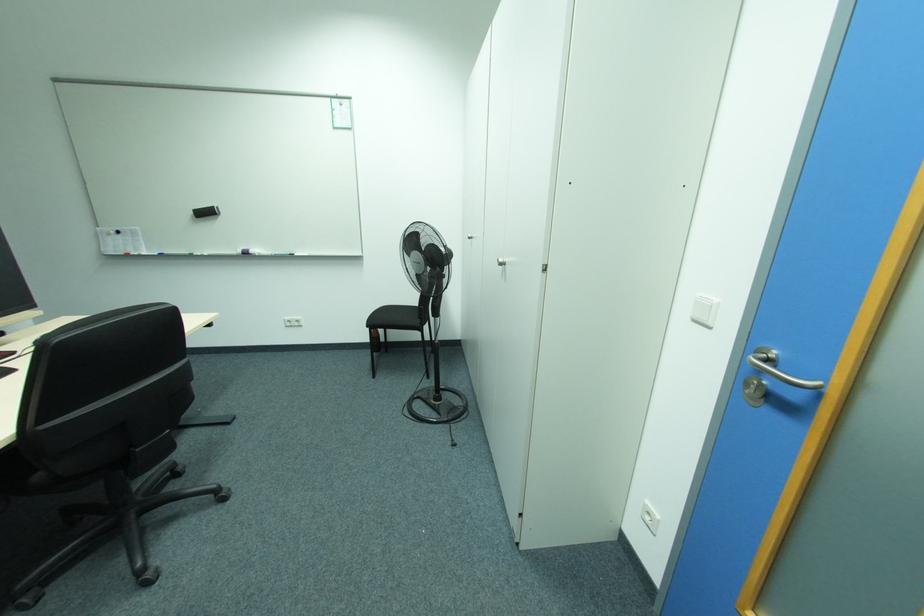
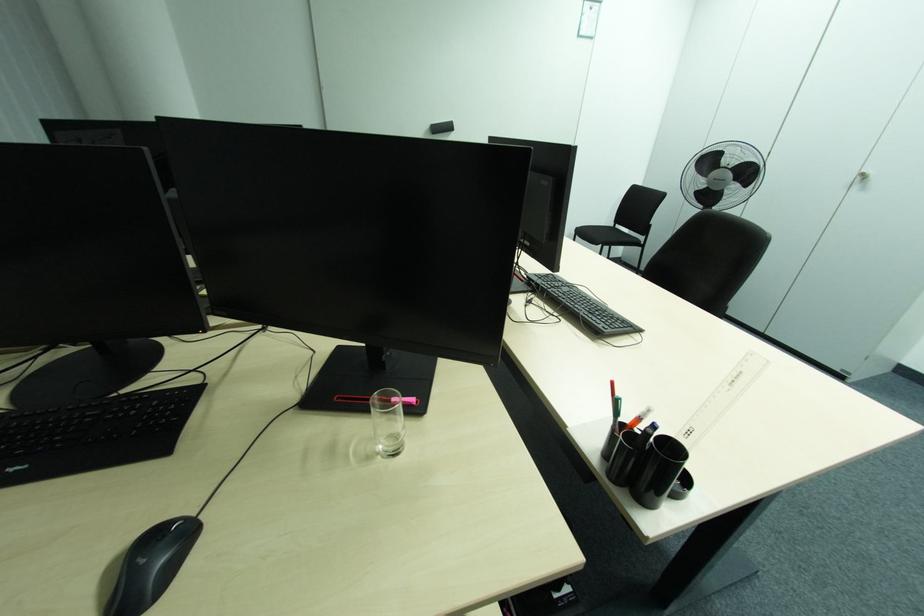
Question: In a continuous first-person perspective shot, in which direction is the camera moving?

Choices:
 (A) Left
 (B) Right
 (C) Forward
 (D) Backward

Answer: (A)